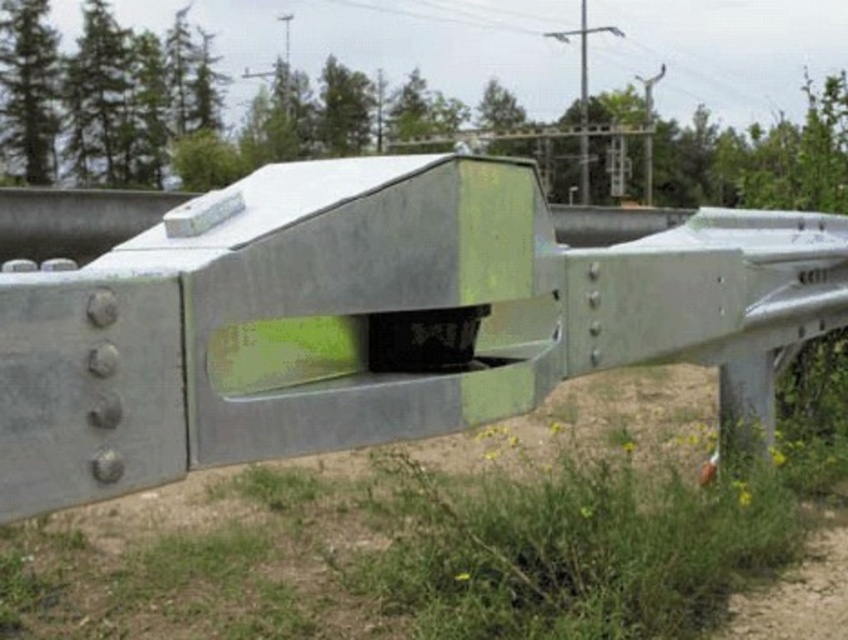
Question: Considering the relative positions of dirt track at lower center and green grass at lower right in the image provided, where is dirt track at lower center located with respect to green grass at lower right?

Choices:
 (A) left
 (B) right

Answer: (A)

Question: Which object is farther from the camera taking this photo?

Choices:
 (A) green grass at lower right
 (B) green matte metal rail at center

Answer: (A)

Question: Which of the following is the closest to the observer?

Choices:
 (A) green grass at lower right
 (B) dirt track at lower center

Answer: (A)

Question: Can you confirm if green matte metal rail at center is smaller than green grass at lower right?

Choices:
 (A) yes
 (B) no

Answer: (B)

Question: Which of these objects is positioned closest to the green matte metal rail at center?

Choices:
 (A) green grass at lower right
 (B) dirt track at lower center

Answer: (A)

Question: Is green matte metal rail at center bigger than dirt track at lower center?

Choices:
 (A) yes
 (B) no

Answer: (A)